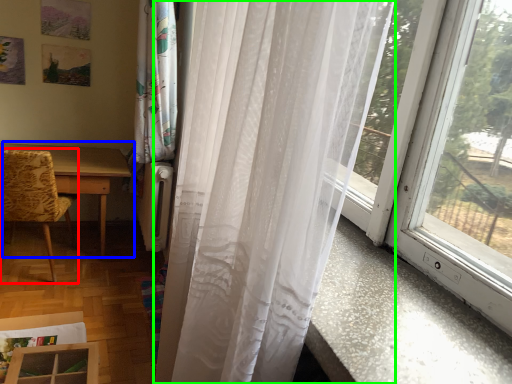
Question: Considering the real-world distances, which object is farthest from chair (highlighted by a red box)? table (highlighted by a blue box) or curtain (highlighted by a green box)?

Choices:
 (A) table
 (B) curtain

Answer: (B)